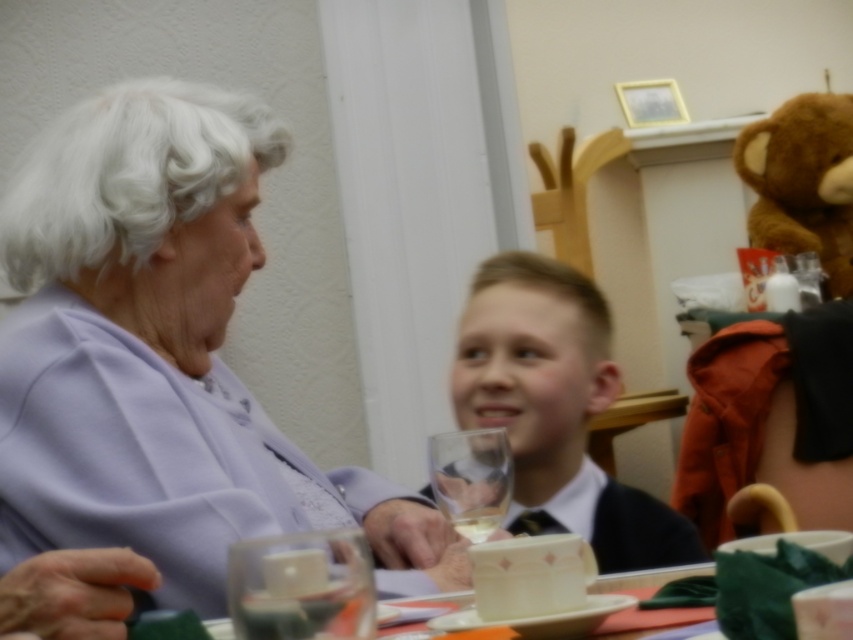
You are a delivery robot with a width of 1 meter. You need to deliver a package from the brown plush teddy bear at upper right to the transparent glass at lower center. Can you navigate the space between them without any obstacles?

The distance between the brown plush teddy bear at upper right and the transparent glass at lower center is 3.11 meters. Since the robot is 1 meter wide, there is sufficient space to navigate the 3.11 meter gap between them without obstacles.

You are a photographer setting up for a family photo. You notice the brown plush teddy bear at upper right and the transparent glass at lower center. Which object is wider?

The brown plush teddy bear at upper right is wider than the transparent glass at lower center.

You are a photographer setting up for a family portrait. You need to position the matte black tie at center and the brown plush teddy bear at upper right in a way that maintains their current spatial relationship. Where should you place the teddy bear relative to the tie?

The brown plush teddy bear at upper right should be placed to the right of the matte black tie at center to maintain their current spatial relationship.